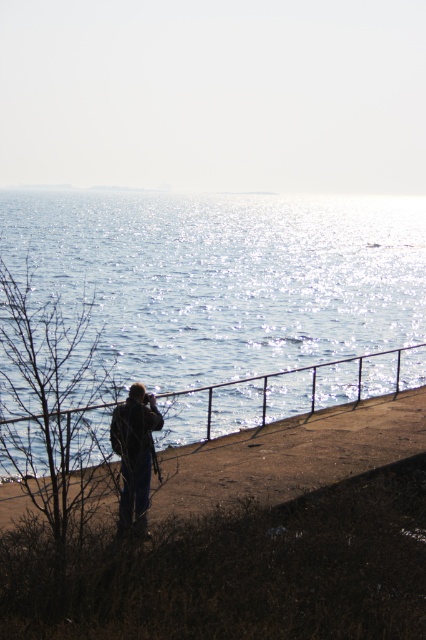
You are standing on the beach and see the glistening blue water at center and the dark blue jeans at lower left. Which object is located to the left of the other?

The glistening blue water at center is positioned on the left side of dark blue jeans at lower left, so the glistening blue water at center is to the left of the dark blue jeans at lower left.

Based on the photo, you are standing on the beach in the coastal scene and want to place a small bucket between the brown dirt at lower left and the dark blue jeans at lower left. Which object should you place it next to if you want it closer to the water?

The brown dirt at lower left has a smaller width than the dark blue jeans at lower left, so placing the bucket next to the brown dirt at lower left would position it closer to the water.

You are standing on the brown dirt at lower left and want to walk to the glistening blue water at center. Which direction should you move to reach it?

You should move towards the center from the brown dirt at lower left to reach the glistening blue water at center, as it is higher in elevation.